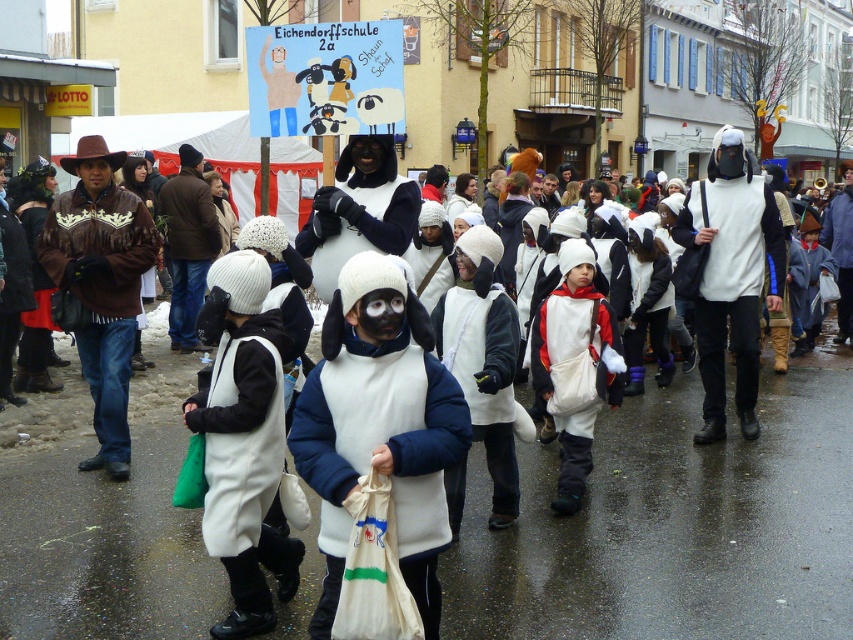
Question: Does white fleece costume at center appear on the right side of white matte vest at center?

Choices:
 (A) no
 (B) yes

Answer: (A)

Question: Does white fleece vest at center appear on the right side of white matte penguin at center?

Choices:
 (A) yes
 (B) no

Answer: (B)

Question: Which of the following is the farthest from the observer?

Choices:
 (A) (589, 358)
 (B) (723, 346)
 (C) (445, 324)

Answer: (B)

Question: Which of these objects is positioned closest to the white matte vest at center?

Choices:
 (A) white matte penguin at center
 (B) white fleece costume at center
 (C) brown leather jacket at left
 (D) white matte snowsuit at center

Answer: (A)

Question: Among these points, which one is farthest from the camera?

Choices:
 (A) (515, 310)
 (B) (618, 355)
 (C) (264, 340)

Answer: (B)

Question: Observing the image, what is the correct spatial positioning of brown leather jacket at left in reference to white matte vest at center?

Choices:
 (A) right
 (B) left

Answer: (B)